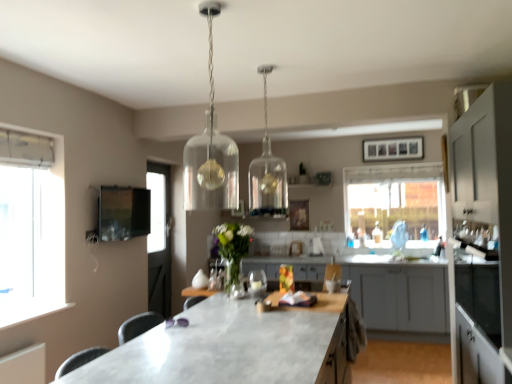
Measure the distance between white marble countertop at center and camera.

The distance of white marble countertop at center from camera is 1.56 meters.

Image resolution: width=512 pixels, height=384 pixels. What are the coordinates of `clear glass pendant light at upper center, which appears as the first lamp when viewed from the left` in the screenshot? It's located at (211, 152).

Describe the element at coordinates (267, 171) in the screenshot. I see `clear glass pendant light at upper center, the 1th lamp when ordered from back to front` at that location.

What do you see at coordinates (399, 293) in the screenshot? I see `matte gray cabinets at center, placed as the first cabinetry when sorted from back to front` at bounding box center [399, 293].

Find the location of a particular element. matte gray cabinets at center, the 2th cabinetry when ordered from front to back is located at coordinates (399, 293).

Find the location of a particular element. translucent glass vase at center is located at coordinates (233, 247).

Does transparent glass window at center have a greater height compared to clear glass wine glass at center?

Yes.

Could you tell me if transparent glass window at center is facing clear glass wine glass at center?

Yes, transparent glass window at center is aimed at clear glass wine glass at center.

Is transparent glass window at center bigger than clear glass wine glass at center?

Correct, transparent glass window at center is larger in size than clear glass wine glass at center.

Based on the photo, is there a large distance between transparent glass window at center and clear glass wine glass at center?

Yes, transparent glass window at center is far from clear glass wine glass at center.

Considering the relative sizes of matte black tv at upper left and white marble countertop at center in the image provided, is matte black tv at upper left taller than white marble countertop at center?

Incorrect, the height of matte black tv at upper left is not larger of that of white marble countertop at center.

What's the angular difference between matte black tv at upper left and white marble countertop at center's facing directions?

The angular difference between matte black tv at upper left and white marble countertop at center is 179 degrees.

How distant is matte black tv at upper left from white marble countertop at center?

They are 1.50 meters apart.

Who is bigger, matte black tv at upper left or white marble countertop at center?

white marble countertop at center.

From the image's perspective, who appears lower, matte black tv at upper left or clear glass pendant light at upper center, marked as the second lamp in a right-to-left arrangement?

matte black tv at upper left is shown below in the image.

Could you tell me if matte black tv at upper left is turned towards clear glass pendant light at upper center, positioned as the first lamp in front-to-back order?

No, matte black tv at upper left is not facing towards clear glass pendant light at upper center, positioned as the first lamp in front-to-back order.

Considering the relative sizes of matte black tv at upper left and clear glass pendant light at upper center, the second lamp when ordered from back to front, in the image provided, is matte black tv at upper left shorter than clear glass pendant light at upper center, the second lamp when ordered from back to front,?

Indeed, matte black tv at upper left has a lesser height compared to clear glass pendant light at upper center, the second lamp when ordered from back to front.

Is matte black tv at upper left not close to clear glass pendant light at upper center, marked as the second lamp in a right-to-left arrangement?

They are positioned close to each other.

Does transparent glass window at center turn towards matte gray cabinets at center, the 2th cabinetry when ordered from front to back?

No, transparent glass window at center does not turn towards matte gray cabinets at center, the 2th cabinetry when ordered from front to back.

I want to click on window above the matte gray cabinets at center, the 2th cabinetry when ordered from front to back (from the image's perspective), so click(x=395, y=202).

Between point (374, 241) and point (432, 303), which one is positioned behind?

The point (374, 241) is farther.

From the picture: In terms of height, does transparent glass window at center look taller or shorter compared to matte gray cabinets at center, placed as the first cabinetry when sorted from back to front?

transparent glass window at center is taller than matte gray cabinets at center, placed as the first cabinetry when sorted from back to front.

From the image's perspective, is clear glass pendant light at upper center, the second lamp when ordered from back to front, below clear glass pendant light at upper center, which is the 1th lamp from right to left?

Yes, from the image's perspective, clear glass pendant light at upper center, the second lamp when ordered from back to front, is below clear glass pendant light at upper center, which is the 1th lamp from right to left.

Considering the relative sizes of clear glass pendant light at upper center, the second lamp when ordered from back to front, and clear glass pendant light at upper center, positioned as the second lamp in front-to-back order, in the image provided, is clear glass pendant light at upper center, the second lamp when ordered from back to front, thinner than clear glass pendant light at upper center, positioned as the second lamp in front-to-back order,?

No.

Is clear glass pendant light at upper center, marked as the second lamp in a right-to-left arrangement, turned away from clear glass pendant light at upper center, positioned as the second lamp in front-to-back order?

No, clear glass pendant light at upper center, positioned as the second lamp in front-to-back order, is not at the back of clear glass pendant light at upper center, marked as the second lamp in a right-to-left arrangement.

In terms of height, does clear glass pendant light at upper center, which appears as the first lamp when viewed from the left, look taller or shorter compared to clear glass pendant light at upper center, the 2th lamp when ordered from left to right?

clear glass pendant light at upper center, which appears as the first lamp when viewed from the left, is taller than clear glass pendant light at upper center, the 2th lamp when ordered from left to right.

From a real-world perspective, who is located higher, white matte cabinet at right, placed as the 2th cabinetry when sorted from back to front, or white marble countertop at center?

white matte cabinet at right, placed as the 2th cabinetry when sorted from back to front, from a real-world perspective.

Is white marble countertop at center completely or partially inside white matte cabinet at right, the 1th cabinetry when ordered from front to back?

No.

Consider the image. From the image's perspective, which is below, white matte cabinet at right, placed as the 2th cabinetry when sorted from back to front, or white marble countertop at center?

white marble countertop at center.

Considering the positions of objects white matte cabinet at right, the 1th cabinetry when ordered from front to back, and white marble countertop at center in the image provided, who is in front, white matte cabinet at right, the 1th cabinetry when ordered from front to back, or white marble countertop at center?

Positioned in front is white marble countertop at center.

Is translucent glass vase at center looking in the opposite direction of white marble countertop at center?

No, translucent glass vase at center's orientation is not away from white marble countertop at center.

What's the angular difference between translucent glass vase at center and white marble countertop at center's facing directions?

0.337 degrees separate the facing orientations of translucent glass vase at center and white marble countertop at center.

From the image's perspective, between translucent glass vase at center and white marble countertop at center, which one is located above?

translucent glass vase at center is shown above in the image.

Which of these two, translucent glass vase at center or white marble countertop at center, is thinner?

With smaller width is translucent glass vase at center.

This screenshot has height=384, width=512. In order to click on wine glass to the left of transparent glass window at center in this screenshot , I will do `click(257, 283)`.

At what (x,y) coordinates should I click in order to perform the action: click on appliance behind the white marble countertop at center. Please return your answer as a coordinate pair (x, y). This screenshot has height=384, width=512. Looking at the image, I should click on (123, 213).

Consider the image. Which object lies nearer to the anchor point matte gray cabinets at center, placed as the first cabinetry when sorted from back to front, clear glass wine glass at center or matte black tv at upper left?

The object closer to matte gray cabinets at center, placed as the first cabinetry when sorted from back to front, is clear glass wine glass at center.

Considering their positions, is white marble countertop at center positioned closer to transparent glass window at center than matte gray cabinets at center, placed as the first cabinetry when sorted from back to front?

matte gray cabinets at center, placed as the first cabinetry when sorted from back to front, is closer to transparent glass window at center.

Based on their spatial positions, is clear glass pendant light at upper center, positioned as the first lamp in front-to-back order, or matte black tv at upper left closer to matte gray cabinets at center, the 2th cabinetry when ordered from front to back?

Based on the image, clear glass pendant light at upper center, positioned as the first lamp in front-to-back order, appears to be nearer to matte gray cabinets at center, the 2th cabinetry when ordered from front to back.

From the image, which object appears to be nearer to matte gray cabinets at center, placed as the first cabinetry when sorted from back to front, matte black tv at upper left or white matte cabinet at right, the 1th cabinetry when ordered from front to back?

white matte cabinet at right, the 1th cabinetry when ordered from front to back.

Which object lies nearer to the anchor point clear glass pendant light at upper center, marked as the second lamp in a right-to-left arrangement, clear glass pendant light at upper center, positioned as the second lamp in front-to-back order, or translucent glass vase at center?

Among the two, translucent glass vase at center is located nearer to clear glass pendant light at upper center, marked as the second lamp in a right-to-left arrangement.

Consider the image. Based on their spatial positions, is clear glass pendant light at upper center, positioned as the second lamp in front-to-back order, or translucent glass vase at center further from clear glass wine glass at center?

clear glass pendant light at upper center, positioned as the second lamp in front-to-back order, lies further to clear glass wine glass at center than the other object.

When comparing their distances from white marble countertop at center, does clear glass wine glass at center or transparent glass window at center seem further?

Among the two, transparent glass window at center is located further to white marble countertop at center.

Looking at the image, which one is located closer to translucent glass vase at center, clear glass wine glass at center or white matte cabinet at right, the 1th cabinetry when ordered from front to back?

clear glass wine glass at center is closer to translucent glass vase at center.

At what (x,y) coordinates should I click in order to perform the action: click on flower between white marble countertop at center and clear glass wine glass at center along the z-axis. Please return your answer as a coordinate pair (x, y). Looking at the image, I should click on (233, 247).

The height and width of the screenshot is (384, 512). Identify the location of wine glass between clear glass pendant light at upper center, which appears as the first lamp when viewed from the left, and transparent glass window at center in the front-back direction. (257, 283).

I want to click on flower positioned between white marble countertop at center and matte black tv at upper left from near to far, so click(x=233, y=247).

At what (x,y) coordinates should I click in order to perform the action: click on lamp between clear glass wine glass at center and white matte cabinet at right, the 1th cabinetry when ordered from front to back. Please return your answer as a coordinate pair (x, y). The height and width of the screenshot is (384, 512). Looking at the image, I should click on (267, 171).